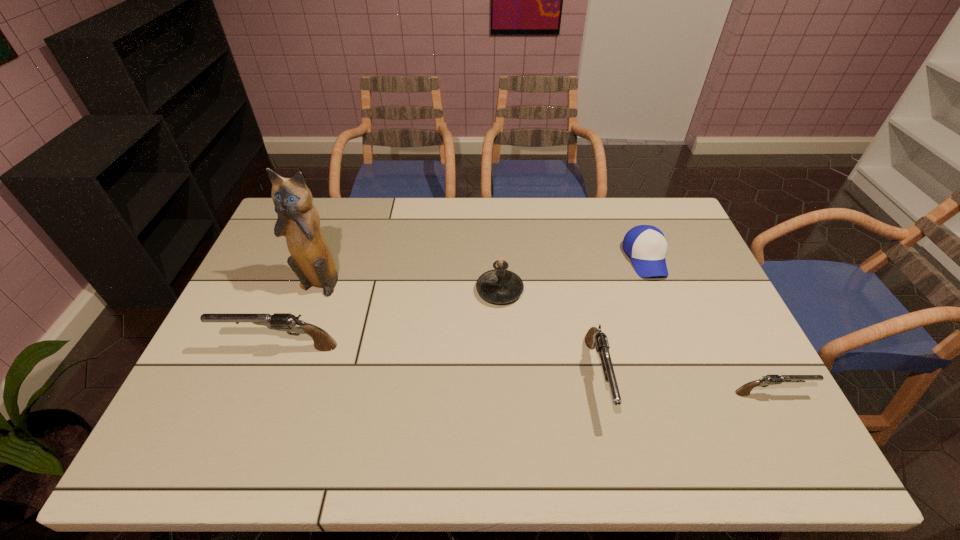
In order to click on the leftmost gun in this screenshot , I will do `click(288, 322)`.

Locate an element on the screen. This screenshot has height=540, width=960. the third shortest object is located at coordinates (595, 338).

Where is `the third object from right to left`? the third object from right to left is located at coordinates (595, 338).

Find the location of a particular element. The height and width of the screenshot is (540, 960). the shortest gun is located at coordinates (744, 390).

Where is `the rightmost gun`? The image size is (960, 540). the rightmost gun is located at coordinates (x=744, y=390).

I want to click on cat, so click(x=311, y=260).

Locate an element on the screen. The image size is (960, 540). baseball cap is located at coordinates (646, 245).

What are the coordinates of `the second shortest object` in the screenshot? It's located at (646, 245).

Identify the location of candle. (499, 285).

Identify the location of vacant space located on the face of the cat. The image size is (960, 540). (307, 312).